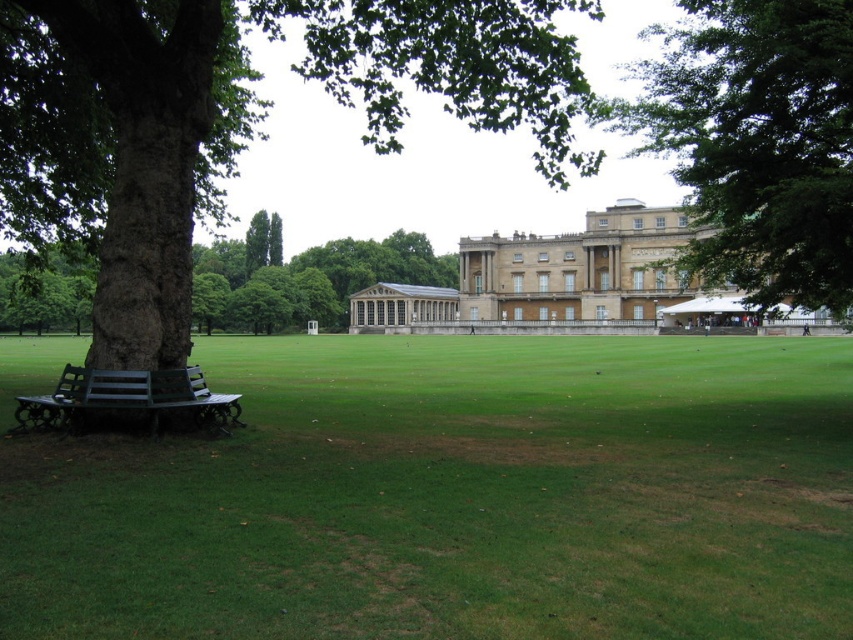
You are a visitor in the park and want to sit on the green painted wood bench at lower left. Can you see the tree trunk of the green rough bark tree at left from the bench?

Yes, because the green rough bark tree at left is positioned over the green painted wood bench at lower left, so the tree trunk would be visible from the bench.

You are a visitor in the park and want to sit on the green painted wood bench at lower left. Can you see the brown rough bark tree at left from that bench?

Yes, because the brown rough bark tree at left is above the green painted wood bench at lower left, so it should be visible from the bench.

You are standing in the park and want to take a photo of both the green leafy tree at upper right and the brown rough bark tree at left. Which tree should you position closer to the camera to include both in the frame?

To include both trees in the frame, position closer to the green leafy tree at upper right since it is in front of the brown rough bark tree at left, allowing both to be captured without one blocking the other.